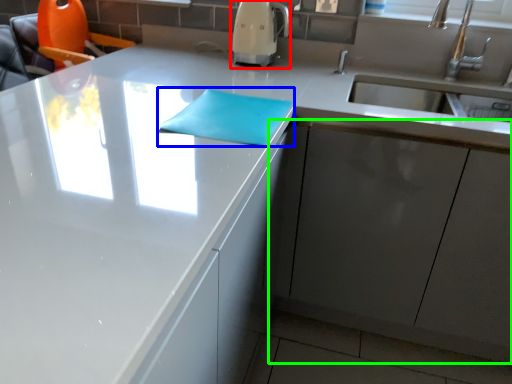
Question: Based on their relative distances, which object is farther from coffee machine (highlighted by a red box)? Choose from notepad (highlighted by a blue box) and cabinetry (highlighted by a green box).

Choices:
 (A) notepad
 (B) cabinetry

Answer: (B)